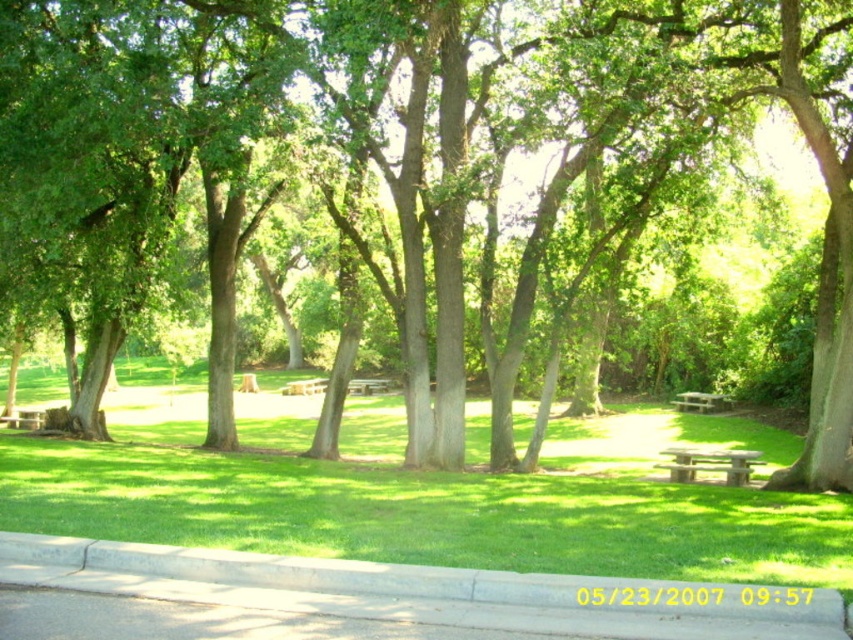
You are a person with a height of 1.7 meters. You are standing on the gray concrete curb at lower center and want to sit on the green wooden bench at center. Can you comfortably sit on the bench without needing to bend down too much?

The gray concrete curb at lower center has a lesser height compared to the green wooden bench at center. Since the curb is lower than the bench, you can comfortably sit on the bench without bending down too much.

You are a gardener who needs to water the gray concrete curb at lower center and the green wooden bench at center. Your watering can holds enough water to cover 40 meters. Can you water both objects without refilling?

The distance between the gray concrete curb at lower center and the green wooden bench at center is 39.92 meters. Since the watering can can cover 40 meters, you can water both objects without needing to refill.